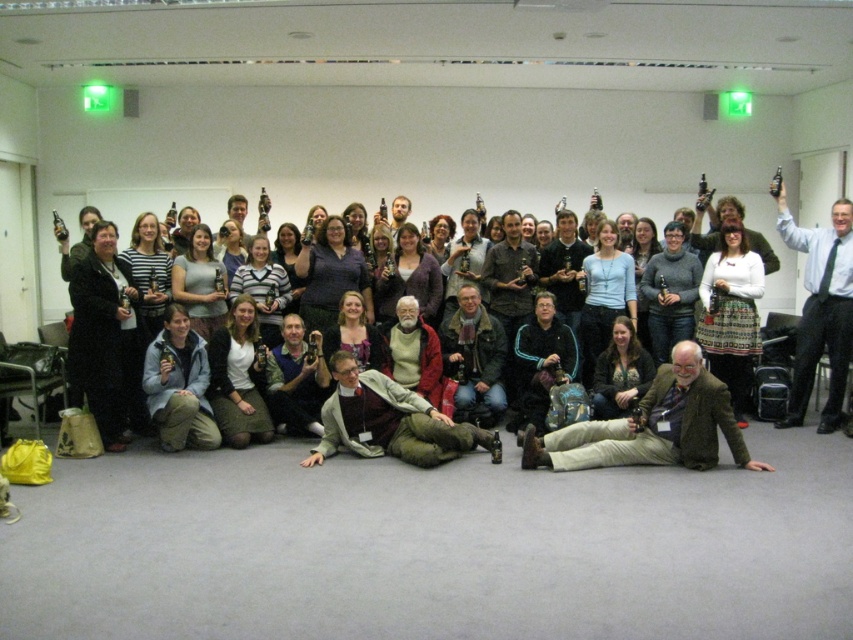
Is light gray sweater at center wider than white shirt at upper right?

Yes.

The image size is (853, 640). In order to click on light gray sweater at center in this screenshot , I will do `click(387, 420)`.